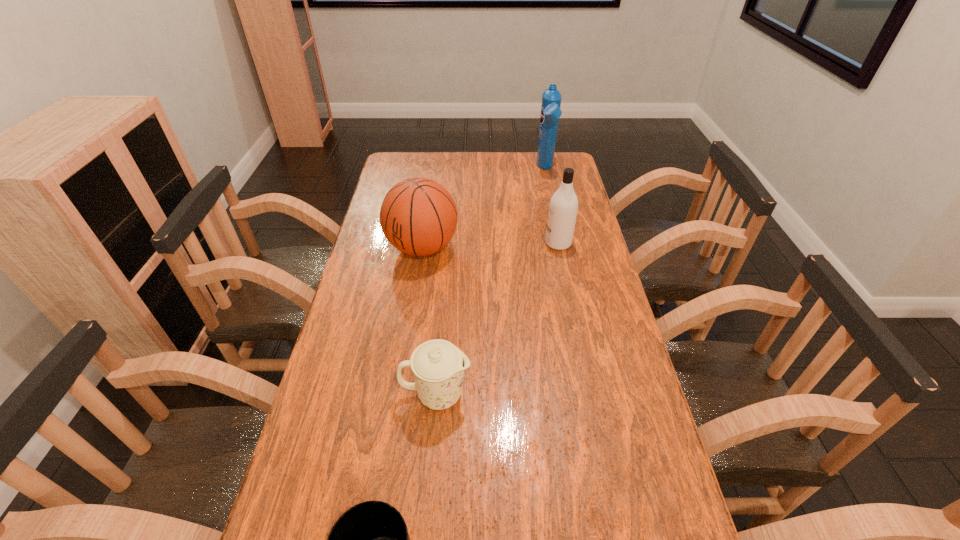
Find the location of a particular element. This screenshot has width=960, height=540. free space located 0.300m on the spout of the second nearest object is located at coordinates (591, 394).

Locate an element on the screen. object that is at the far edge is located at coordinates (551, 98).

You are a GUI agent. You are given a task and a screenshot of the screen. Output one action in this format:
    pyautogui.click(x=<x>, y=<y>)
    Task: Click on the object at the left edge
    The width and height of the screenshot is (960, 540).
    Given the screenshot: What is the action you would take?
    pyautogui.click(x=418, y=216)

Identify the location of object present at the far right corner. This screenshot has width=960, height=540. (551, 98).

At what (x,y) coordinates should I click in order to perform the action: click on vacant region at the far edge of the desktop. Please return your answer as a coordinate pair (x, y). Image resolution: width=960 pixels, height=540 pixels. Looking at the image, I should click on (533, 170).

You are a GUI agent. You are given a task and a screenshot of the screen. Output one action in this format:
    pyautogui.click(x=<x>, y=<y>)
    Task: Click on the vacant space at the left edge
    The image size is (960, 540).
    Given the screenshot: What is the action you would take?
    pyautogui.click(x=359, y=334)

In the image, there is a desktop. Identify the location of vacant space at the right edge. The height and width of the screenshot is (540, 960). (611, 301).

The image size is (960, 540). In the image, there is a desktop. Identify the location of free space at the far left corner. (385, 178).

I want to click on blank space at the far right corner, so click(x=549, y=172).

This screenshot has height=540, width=960. Identify the location of free spot between the basketball and the tallest object. click(484, 208).